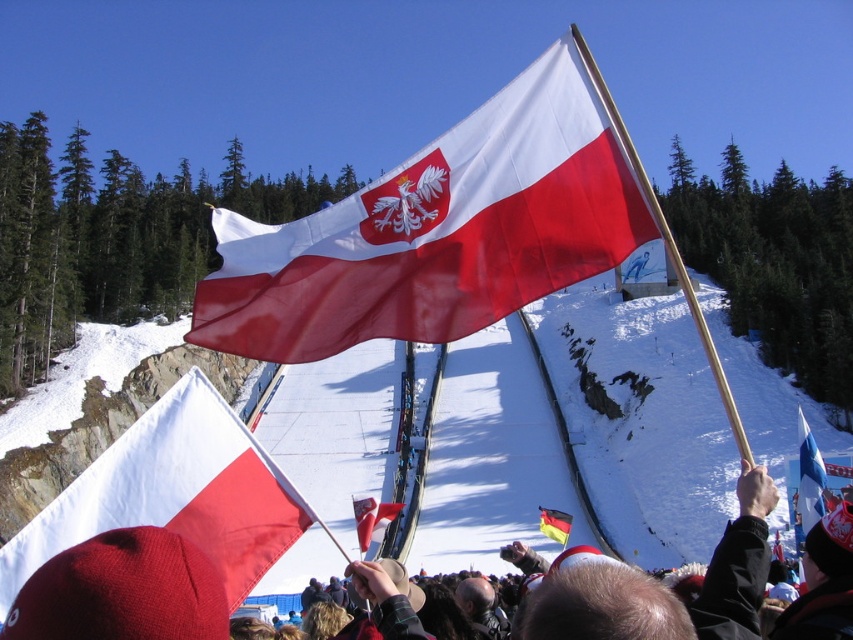
Question: In this image, where is matte fabric flag at center located relative to matte red flag at center?

Choices:
 (A) left
 (B) right

Answer: (B)

Question: Considering the relative positions of matte red hat at center and white matte flag at center in the image provided, where is matte red hat at center located with respect to white matte flag at center?

Choices:
 (A) below
 (B) above

Answer: (A)

Question: Can you confirm if matte fabric flag at center is positioned below matte red flag at center?

Choices:
 (A) yes
 (B) no

Answer: (B)

Question: Which point appears closest to the camera in this image?

Choices:
 (A) (363, 531)
 (B) (184, 572)
 (C) (798, 481)
 (D) (181, 412)

Answer: (B)

Question: Which point is closer to the camera?

Choices:
 (A) white fabric flag at right
 (B) white matte flag at center
 (C) matte fabric flag at center
 (D) red fabric flag at upper center

Answer: (B)

Question: Which of the following is the closest to the observer?

Choices:
 (A) white matte flag at center
 (B) matte red flag at center
 (C) matte fabric flag at center

Answer: (A)